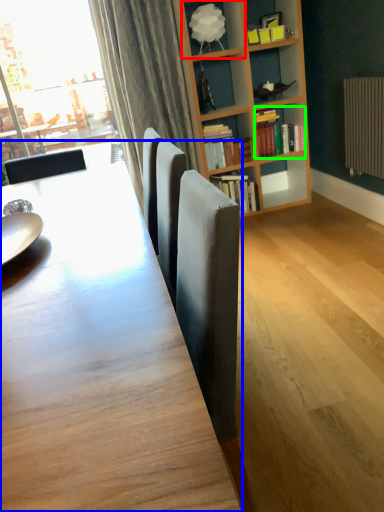
Question: Considering the real-world distances, which object is closest to shelf (highlighted by a red box)? table (highlighted by a blue box) or book (highlighted by a green box).

Choices:
 (A) table
 (B) book

Answer: (B)